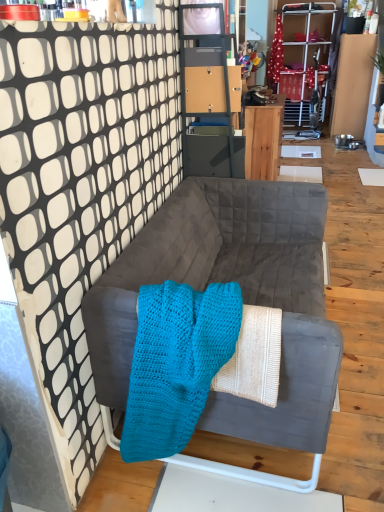
Question: Could you tell me if wooden desk at center is facing matte gray cabinet at upper center?

Choices:
 (A) yes
 (B) no

Answer: (B)

Question: From the image's perspective, does wooden desk at center appear lower than matte gray cabinet at upper center?

Choices:
 (A) no
 (B) yes

Answer: (A)

Question: Does wooden desk at center have a smaller size compared to matte gray cabinet at upper center?

Choices:
 (A) yes
 (B) no

Answer: (B)

Question: Is wooden desk at center positioned before matte gray cabinet at upper center?

Choices:
 (A) yes
 (B) no

Answer: (B)

Question: Is matte gray cabinet at upper center surrounded by wooden desk at center?

Choices:
 (A) no
 (B) yes

Answer: (A)

Question: Can you confirm if wooden desk at center is positioned to the right of matte gray cabinet at upper center?

Choices:
 (A) no
 (B) yes

Answer: (B)

Question: Is wooden desk at center not inside suede gray couch at center?

Choices:
 (A) no
 (B) yes

Answer: (B)

Question: Does wooden desk at center have a lesser width compared to suede gray couch at center?

Choices:
 (A) no
 (B) yes

Answer: (B)

Question: Could you tell me if wooden desk at center is facing suede gray couch at center?

Choices:
 (A) yes
 (B) no

Answer: (B)

Question: From the image's perspective, is wooden desk at center on top of suede gray couch at center?

Choices:
 (A) yes
 (B) no

Answer: (A)

Question: Is wooden desk at center positioned behind suede gray couch at center?

Choices:
 (A) no
 (B) yes

Answer: (B)

Question: Can you confirm if wooden desk at center is positioned to the left of suede gray couch at center?

Choices:
 (A) yes
 (B) no

Answer: (B)

Question: From a real-world perspective, is suede gray couch at center over matte gray cabinet at upper center?

Choices:
 (A) no
 (B) yes

Answer: (A)